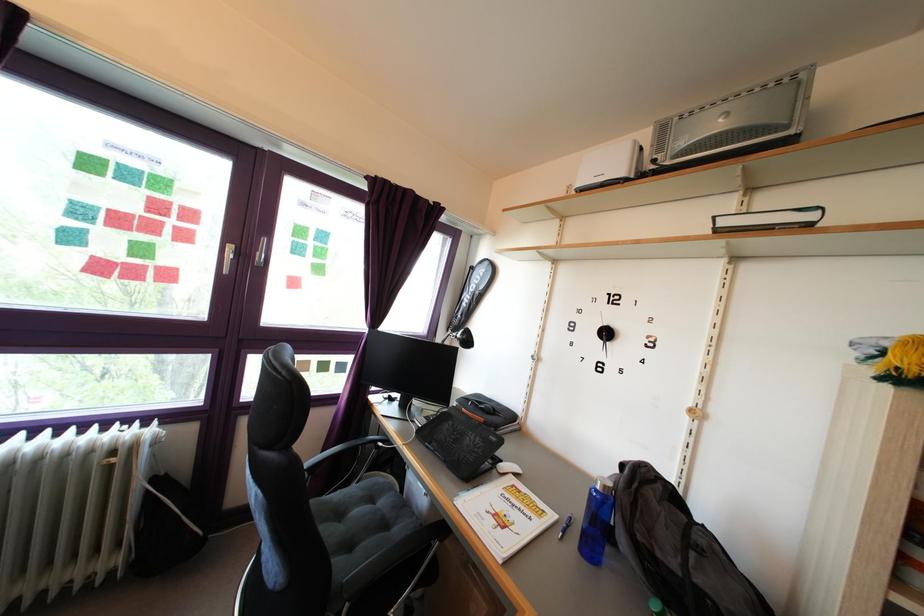
Image resolution: width=924 pixels, height=616 pixels. What do you see at coordinates (261, 252) in the screenshot?
I see `a silver window handle` at bounding box center [261, 252].